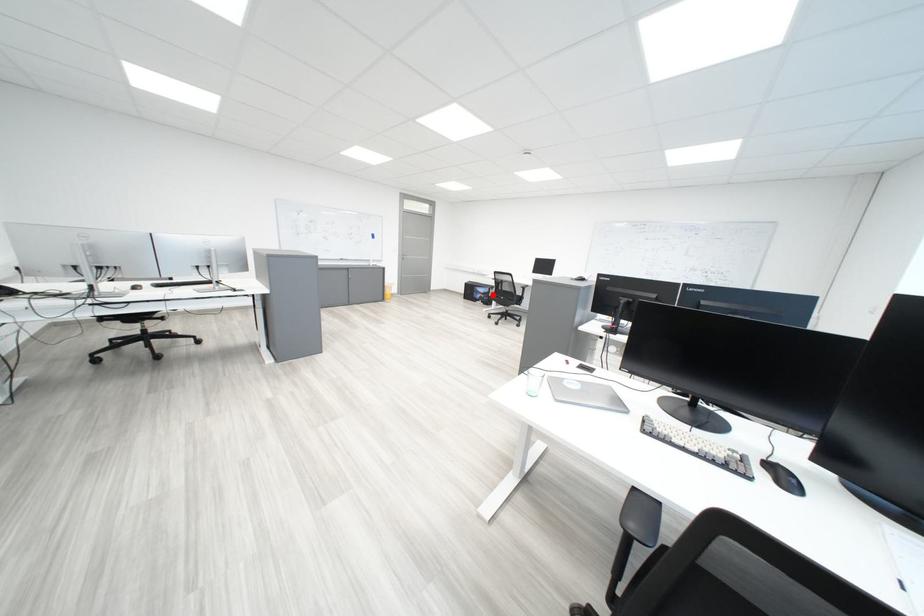
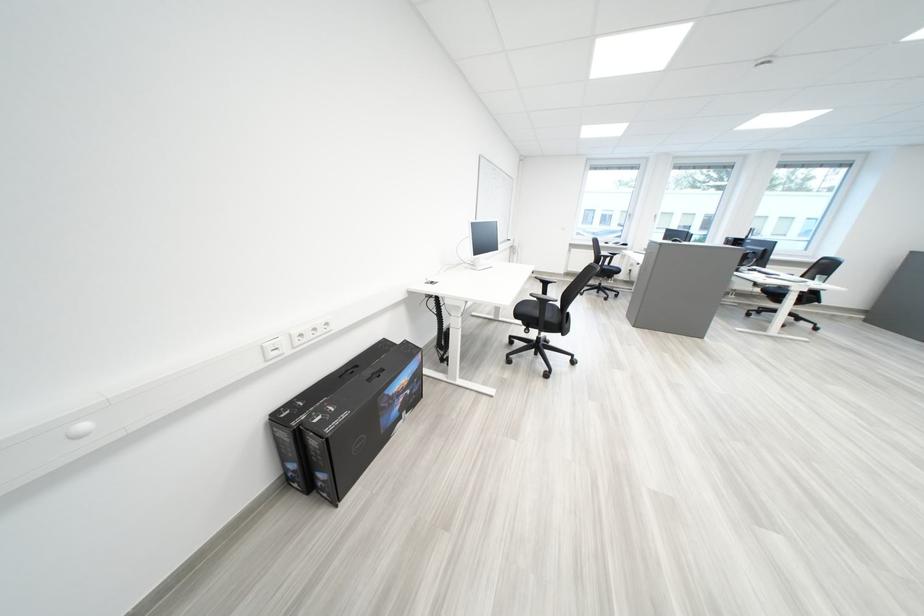
The point at the highlighted location is marked in the first image. Where is the corresponding point in the second image?

(411, 395)